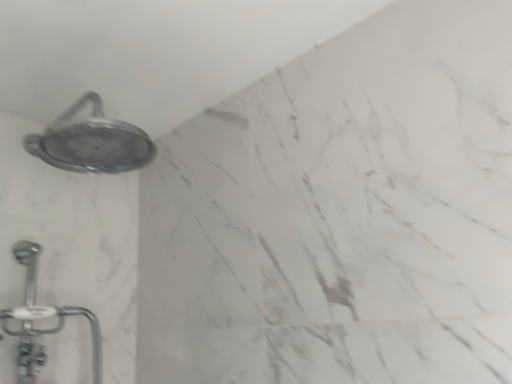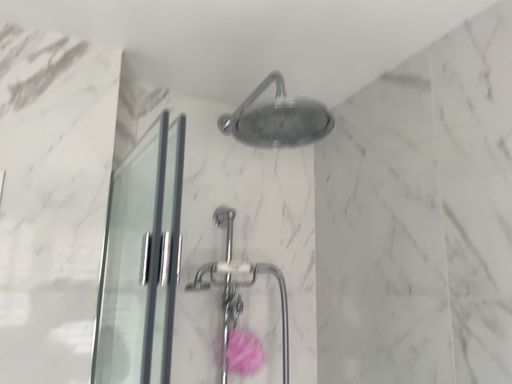
Question: Which way did the camera rotate in the video?

Choices:
 (A) rotated right
 (B) rotated left

Answer: (B)